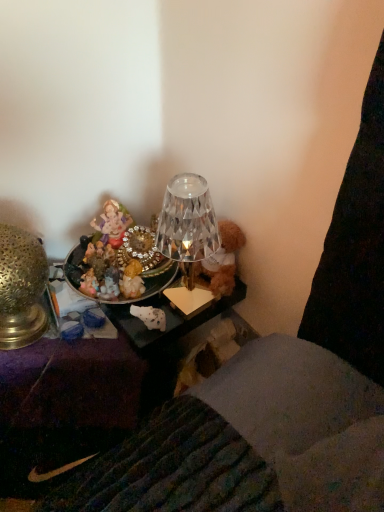
In order to face metallic/mesh tray at left, should I rotate leftwards or rightwards?

A 16.336 degree turn to the left will do.

Find the location of a particular element. This screenshot has width=384, height=512. metallic/mesh tray at left is located at coordinates (85, 394).

Is point (97, 370) closer to camera compared to point (119, 244)?

No.

Is there a large distance between metallic/mesh tray at left and porcelain figurine at upper center?

Actually, metallic/mesh tray at left and porcelain figurine at upper center are a little close together.

From the image's perspective, is metallic/mesh tray at left below porcelain figurine at upper center?

Yes.

Which object is thinner, metallic/mesh tray at left or gold textured lamp at left?

gold textured lamp at left.

Considering the sizes of metallic/mesh tray at left and gold textured lamp at left in the image, is metallic/mesh tray at left bigger or smaller than gold textured lamp at left?

In the image, metallic/mesh tray at left appears to be larger than gold textured lamp at left.

Who is shorter, metallic/mesh tray at left or gold textured lamp at left?

gold textured lamp at left is shorter.

From the image's perspective, which is below, metallic/mesh tray at left or gold textured lamp at left?

metallic/mesh tray at left appears lower in the image.

Is point (21, 245) farther from camera compared to point (152, 337)?

No, it is in front of (152, 337).

Can you confirm if gold textured lamp at left is taller than metallic/mesh tray at left?

No.

Identify the location of lamp above the metallic/mesh tray at left (from the image's perspective). (21, 288).

From the image's perspective, is gold textured lamp at left on top of metallic/mesh tray at left?

Yes, from the image's perspective, gold textured lamp at left is above metallic/mesh tray at left.

Consider the image. Is porcelain figurine at upper center to the left of metallic/mesh tray at left from the viewer's perspective?

Incorrect, porcelain figurine at upper center is not on the left side of metallic/mesh tray at left.

Which point is more forward, (113, 241) or (21, 441)?

Point (113, 241)

Considering the sizes of objects porcelain figurine at upper center and metallic/mesh tray at left in the image provided, who is taller, porcelain figurine at upper center or metallic/mesh tray at left?

metallic/mesh tray at left.

Does porcelain figurine at upper center have a larger size compared to metallic/mesh tray at left?

Incorrect, porcelain figurine at upper center is not larger than metallic/mesh tray at left.

Would you say porcelain figurine at upper center is inside or outside gold textured lamp at left?

The correct answer is: outside.

Is porcelain figurine at upper center far away from gold textured lamp at left?

No, porcelain figurine at upper center is not far away from gold textured lamp at left.

Can you confirm if porcelain figurine at upper center is smaller than gold textured lamp at left?

Yes, porcelain figurine at upper center is smaller than gold textured lamp at left.

Does porcelain figurine at upper center appear on the right side of gold textured lamp at left?

Yes, porcelain figurine at upper center is to the right of gold textured lamp at left.

Does gold textured lamp at left contain porcelain figurine at upper center?

That's incorrect, porcelain figurine at upper center is not inside gold textured lamp at left.

From the image's perspective, would you say gold textured lamp at left is shown under porcelain figurine at upper center?

Yes.

Where is `person above the gold textured lamp at left (from a real-world perspective)`? The width and height of the screenshot is (384, 512). person above the gold textured lamp at left (from a real-world perspective) is located at coordinates 111,224.

I want to click on person above the metallic/mesh tray at left (from the image's perspective), so click(x=111, y=224).

Find the location of `furniture below the gold textured lamp at left (from a real-world perspective)`. furniture below the gold textured lamp at left (from a real-world perspective) is located at coordinates (85, 394).

Looking at the image, which one is located closer to porcelain figurine at upper center, gold textured lamp at left or metallic/mesh tray at left?

gold textured lamp at left is positioned closer to the anchor porcelain figurine at upper center.

Estimate the real-world distances between objects in this image. Which object is further from metallic/mesh tray at left, porcelain figurine at upper center or gold textured lamp at left?

porcelain figurine at upper center is positioned further to the anchor metallic/mesh tray at left.

Considering their positions, is metallic/mesh tray at left positioned closer to gold textured lamp at left than porcelain figurine at upper center?

Based on the image, porcelain figurine at upper center appears to be nearer to gold textured lamp at left.

Looking at the image, which one is located further to gold textured lamp at left, porcelain figurine at upper center or metallic/mesh tray at left?

metallic/mesh tray at left.

Based on their spatial positions, is gold textured lamp at left or porcelain figurine at upper center closer to metallic/mesh tray at left?

The object closer to metallic/mesh tray at left is gold textured lamp at left.

Which object lies nearer to the anchor point porcelain figurine at upper center, metallic/mesh tray at left or gold textured lamp at left?

gold textured lamp at left lies closer to porcelain figurine at upper center than the other object.

Identify the location of lamp between porcelain figurine at upper center and metallic/mesh tray at left vertically. (21, 288).